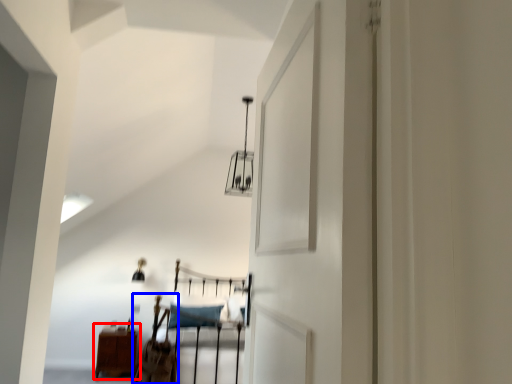
Question: Among these objects, which one is nearest to the camera, furniture (highlighted by a red box) or chair (highlighted by a blue box)?

Choices:
 (A) furniture
 (B) chair

Answer: (B)